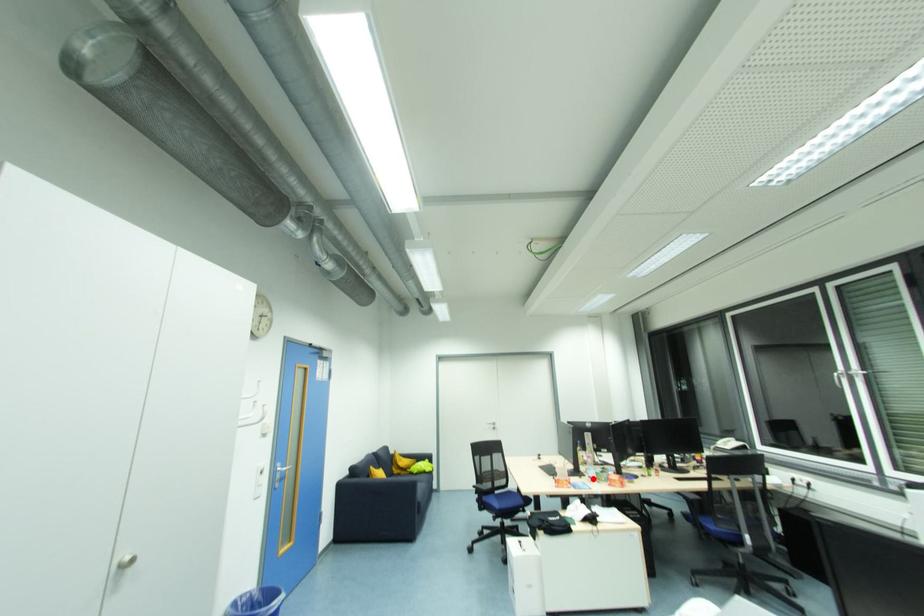
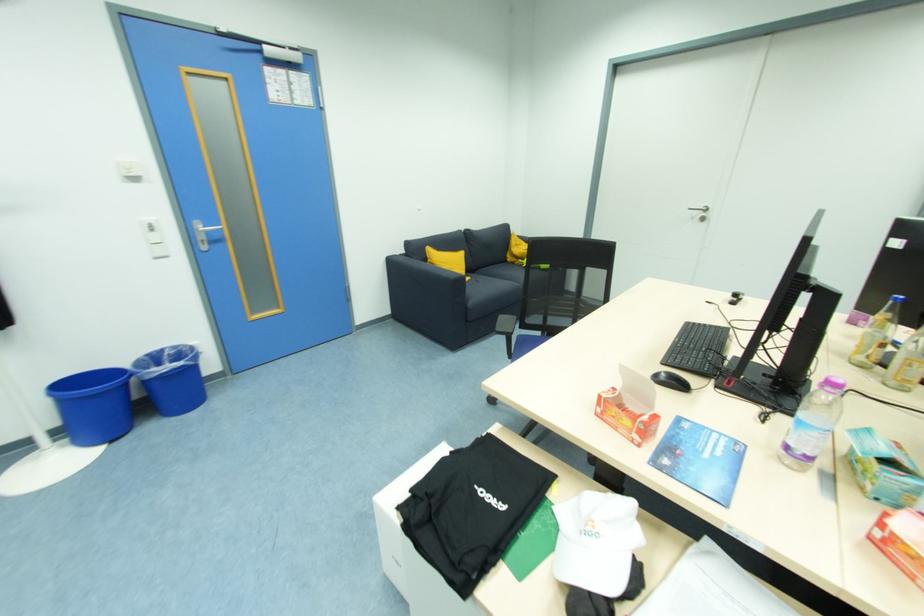
Question: I am providing you with two images of the same scene from different viewpoints. A red point is shown in image1. For the corresponding object point in image2, is it positioned nearer or farther from the camera?

Choices:
 (A) Nearer
 (B) Farther

Answer: (A)